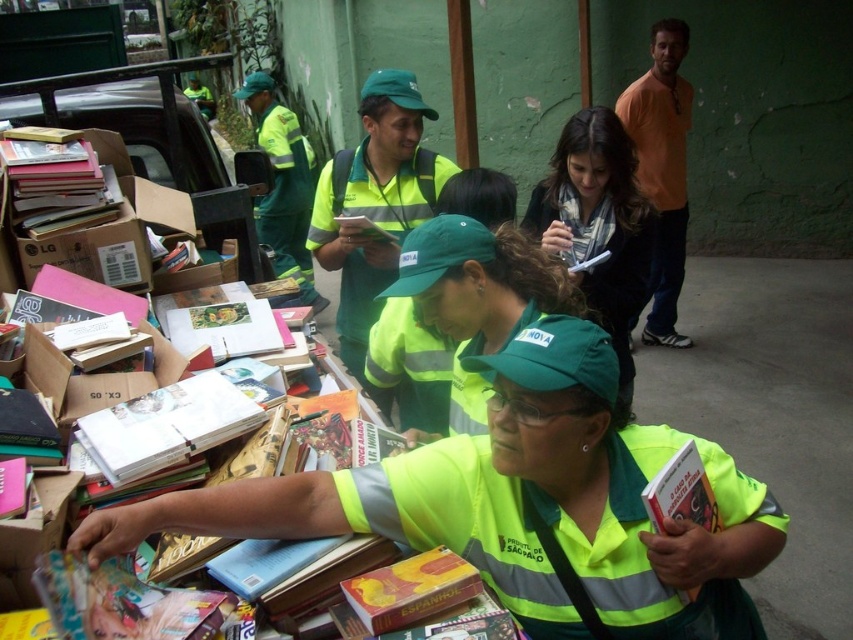
Question: Among these objects, which one is farthest from the camera?

Choices:
 (A) green uniform at center
 (B) orange cotton shirt at upper right
 (C) green reflective uniform at center
 (D) yellow paper book at center

Answer: (A)

Question: Does green reflective uniform at center appear on the right side of yellow paper book at center?

Choices:
 (A) yes
 (B) no

Answer: (A)

Question: Considering the relative positions of orange cotton shirt at upper right and hardcover book at lower center in the image provided, where is orange cotton shirt at upper right located with respect to hardcover book at lower center?

Choices:
 (A) below
 (B) above

Answer: (B)

Question: Which of the following is the closest to the observer?

Choices:
 (A) matte green scarf at center
 (B) orange cotton shirt at upper right

Answer: (A)

Question: Which object appears closest to the camera in this image?

Choices:
 (A) green reflective vest at center
 (B) green reflective uniform at center
 (C) yellow paper book at center

Answer: (A)

Question: Is matte green scarf at center closer to camera compared to orange cotton shirt at upper right?

Choices:
 (A) yes
 (B) no

Answer: (A)